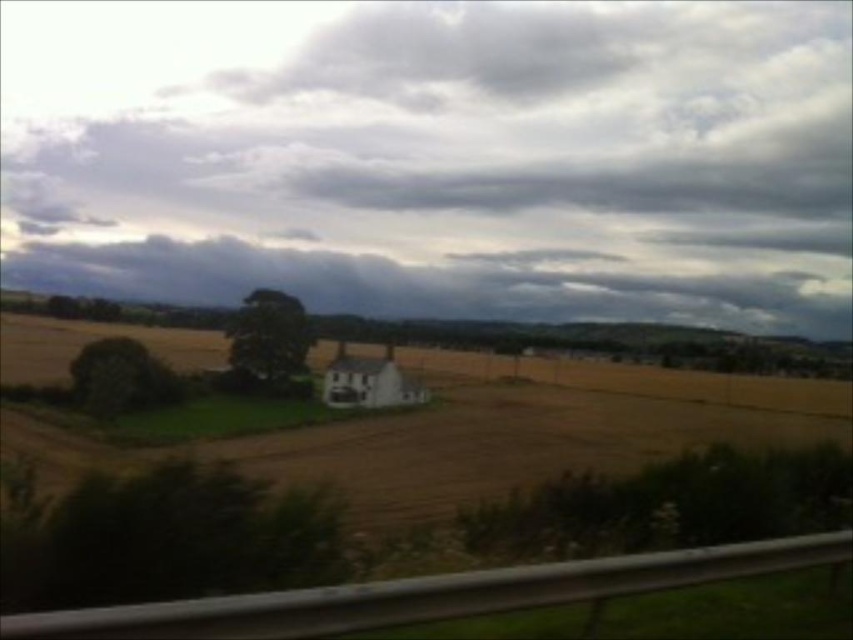
You are standing in the middle of the field looking at the cloudy sky at upper center and the green leafy tree at center. Which object is closer to you?

The green leafy tree at center is closer to you than the cloudy sky at upper center because the cloudy sky at upper center is further away.

You are a drone operator planning to fly a drone from the green leafy tree at left to the cloudy sky at upper center. According to the image, what is the approximate distance you need to cover?

The distance between the cloudy sky at upper center and the green leafy tree at left is 116.96 meters, so the drone needs to cover approximately 117 meters.

You are a photographer trying to capture the entire cloudy sky at upper center and golden matte wheat field at center in one frame. Based on the scene, which object would require you to adjust your camera angle to include more of it in the photo?

The cloudy sky at upper center would require adjusting the camera angle to include more of it because its width is larger than the golden matte wheat field at center.